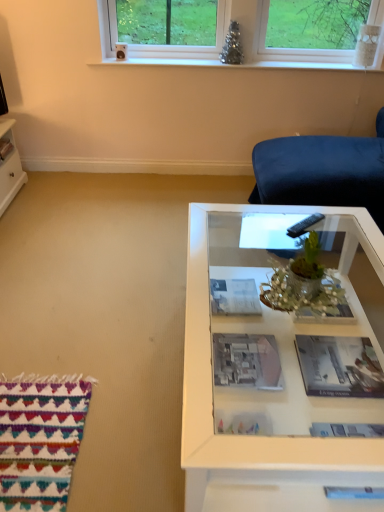
Where is `free spot above matte gray magazine at lower right, which is counted as the 1th magazine, starting from the bottom (from a real-world perspective)`? free spot above matte gray magazine at lower right, which is counted as the 1th magazine, starting from the bottom (from a real-world perspective) is located at coordinates (337, 361).